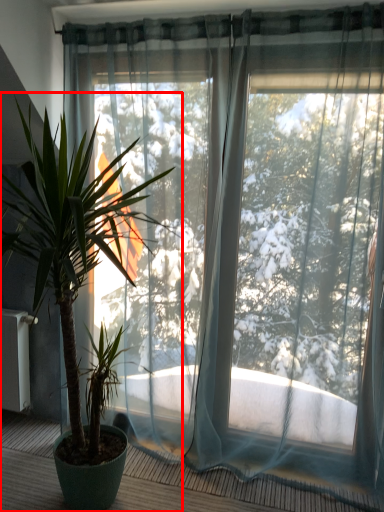
Question: In this image, where is houseplant (annotated by the red box) located relative to balcony?

Choices:
 (A) right
 (B) left

Answer: (B)